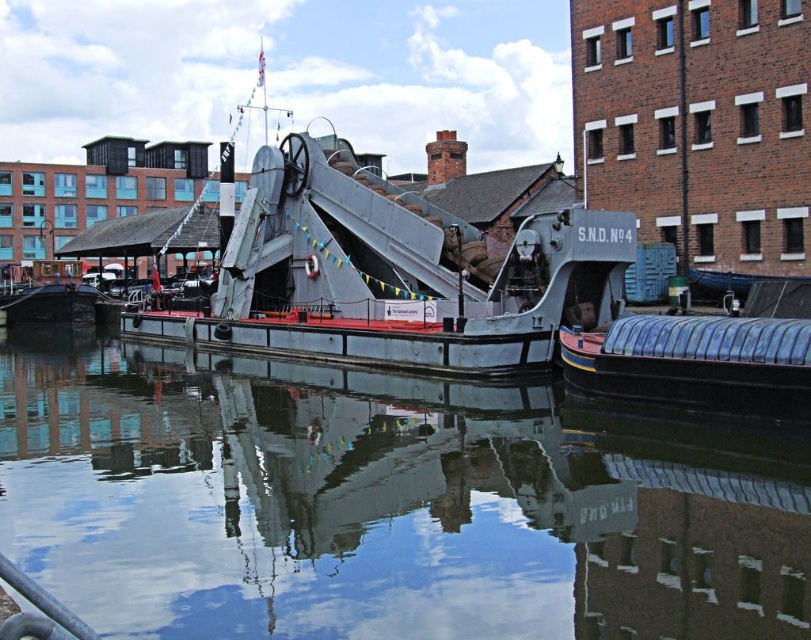
Consider the image. Between transparent water at center and blue rubber boat at lower right, which one is positioned higher?

blue rubber boat at lower right

Who is taller, transparent water at center or blue rubber boat at lower right?

Standing taller between the two is transparent water at center.

Find the location of `transparent water at center`. transparent water at center is located at coordinates (384, 504).

Does transparent water at center appear on the left side of metallic gray boat at center?

Indeed, transparent water at center is positioned on the left side of metallic gray boat at center.

Is transparent water at center above metallic gray boat at center?

No, transparent water at center is not above metallic gray boat at center.

At what (x,y) coordinates should I click in order to perform the action: click on transparent water at center. Please return your answer as a coordinate pair (x, y). This screenshot has height=640, width=811. Looking at the image, I should click on (384, 504).

Who is more forward, [597,257] or [784,368]?

Point [784,368]

Is metallic gray boat at center wider than blue rubber boat at lower right?

Indeed, metallic gray boat at center has a greater width compared to blue rubber boat at lower right.

Is point (286, 307) positioned before point (799, 324)?

No.

I want to click on metallic gray boat at center, so click(x=393, y=275).